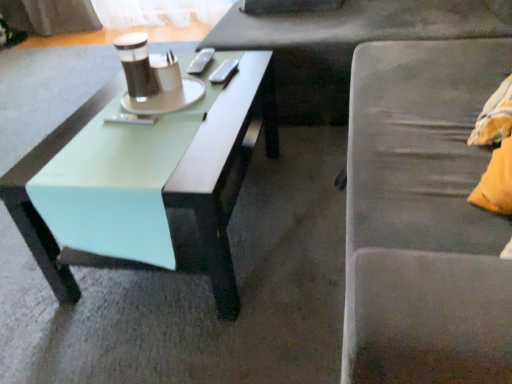
Find the location of a particular element. free location in front of matte black cup at center is located at coordinates (119, 126).